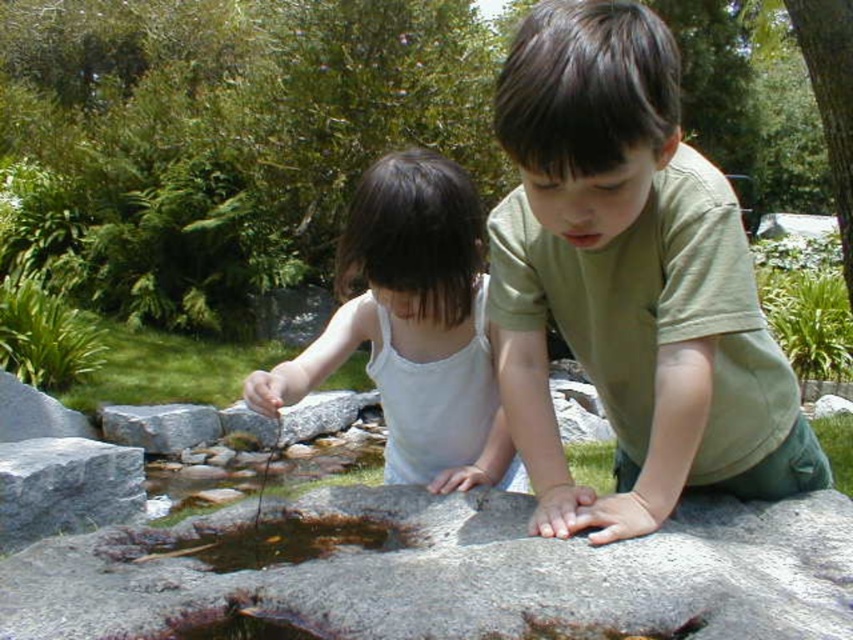
Question: Is gray smooth rock at center thinner than brown wet rock at lower center?

Choices:
 (A) no
 (B) yes

Answer: (A)

Question: Which point is closer to the camera?

Choices:
 (A) (138, 500)
 (B) (320, 536)
 (C) (341, 586)
 (D) (183, 449)

Answer: (C)

Question: Among these points, which one is nearest to the camera?

Choices:
 (A) (135, 413)
 (B) (529, 186)
 (C) (250, 392)
 (D) (216, 564)

Answer: (B)

Question: Does gray smooth rock at center have a larger size compared to white fabric shirt at center?

Choices:
 (A) yes
 (B) no

Answer: (B)

Question: Which object is closer to the camera taking this photo?

Choices:
 (A) gray smooth rock at center
 (B) gray granite rock at center
 (C) green cotton shirt at center
 (D) brown wet rock at lower center

Answer: (A)

Question: Can you confirm if white fabric shirt at center is positioned to the right of gray rough stone at lower left?

Choices:
 (A) yes
 (B) no

Answer: (A)